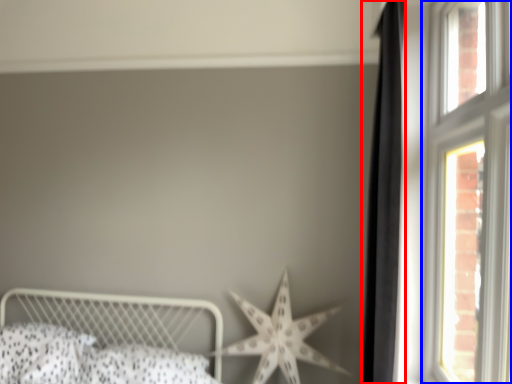
Question: Which object is further to the camera taking this photo, curtain (highlighted by a red box) or window (highlighted by a blue box)?

Choices:
 (A) curtain
 (B) window

Answer: (A)